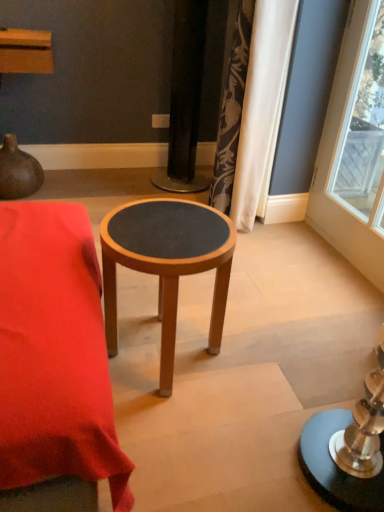
Question: From the image's perspective, is wooden stool at center over silky floral curtain at upper right?

Choices:
 (A) no
 (B) yes

Answer: (A)

Question: Is wooden stool at center beside silky floral curtain at upper right?

Choices:
 (A) no
 (B) yes

Answer: (A)

Question: Considering the relative positions of wooden stool at center and silky floral curtain at upper right in the image provided, is wooden stool at center to the right of silky floral curtain at upper right from the viewer's perspective?

Choices:
 (A) yes
 (B) no

Answer: (B)

Question: Can you confirm if wooden stool at center is wider than silky floral curtain at upper right?

Choices:
 (A) no
 (B) yes

Answer: (B)

Question: From the image's perspective, is wooden stool at center under silky floral curtain at upper right?

Choices:
 (A) yes
 (B) no

Answer: (A)

Question: Based on their positions, is silky floral curtain at upper right located to the left or right of wooden stool at center?

Choices:
 (A) left
 (B) right

Answer: (B)

Question: From the image's perspective, is silky floral curtain at upper right positioned above or below wooden stool at center?

Choices:
 (A) below
 (B) above

Answer: (B)

Question: Is silky floral curtain at upper right in front of or behind wooden stool at center in the image?

Choices:
 (A) behind
 (B) front

Answer: (A)

Question: Does point (243, 115) appear closer or farther from the camera than point (165, 285)?

Choices:
 (A) closer
 (B) farther

Answer: (B)

Question: Considering the positions of wooden stool at center and silky floral curtain at upper right in the image, is wooden stool at center wider or thinner than silky floral curtain at upper right?

Choices:
 (A) thin
 (B) wide

Answer: (B)

Question: From the image's perspective, is wooden stool at center located above or below silky floral curtain at upper right?

Choices:
 (A) below
 (B) above

Answer: (A)

Question: Relative to silky floral curtain at upper right, is wooden stool at center in front or behind?

Choices:
 (A) behind
 (B) front

Answer: (B)

Question: Choose the correct answer: Is wooden stool at center inside silky floral curtain at upper right or outside it?

Choices:
 (A) outside
 (B) inside

Answer: (A)

Question: Is wooden stool at center in front of or behind brown matte vase at upper left in the image?

Choices:
 (A) behind
 (B) front

Answer: (B)

Question: From the image's perspective, is wooden stool at center located above or below brown matte vase at upper left?

Choices:
 (A) above
 (B) below

Answer: (B)